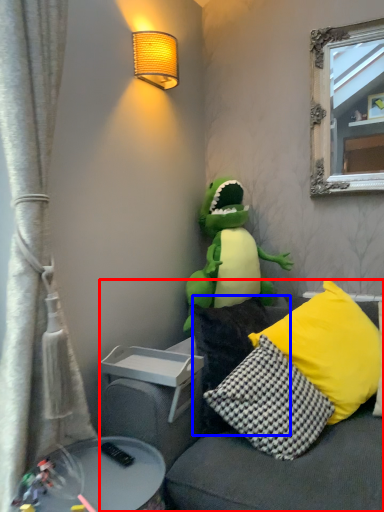
Question: Among these objects, which one is farthest to the camera, studio couch (highlighted by a red box) or pillow (highlighted by a blue box)?

Choices:
 (A) studio couch
 (B) pillow

Answer: (B)